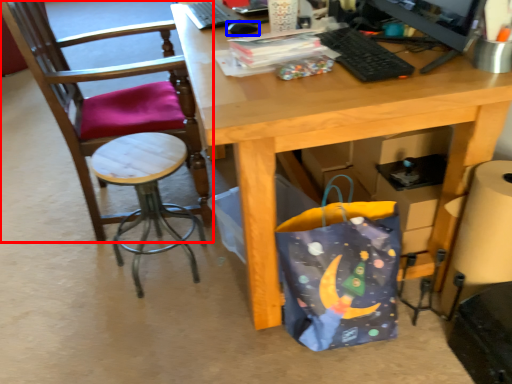
Question: Which object is further to the camera taking this photo, chair (highlighted by a red box) or mouse (highlighted by a blue box)?

Choices:
 (A) chair
 (B) mouse

Answer: (B)